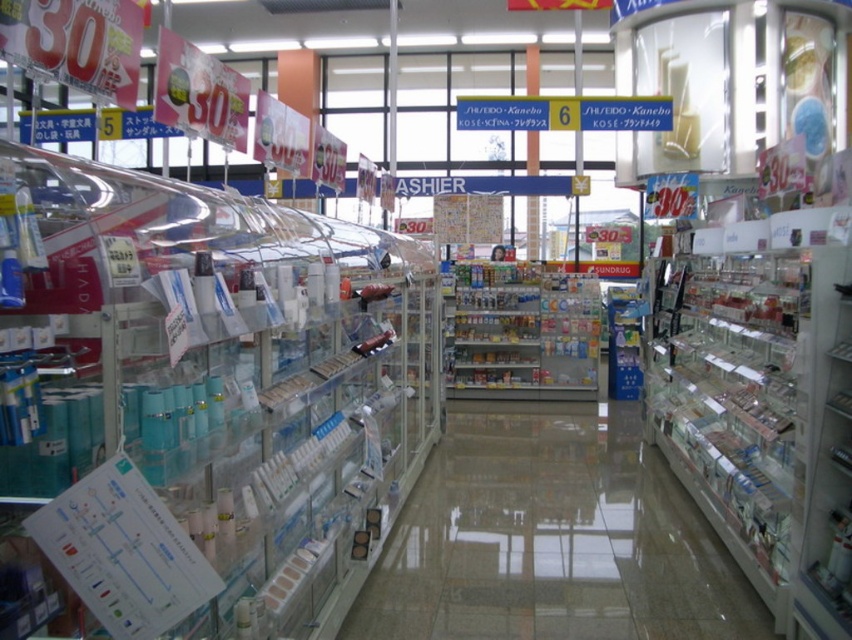
Looking at this image, you are a customer looking for a specific product in the drugstore. You see clear plastic bottles at left and transparent plastic shelves at center. Which object is located to the left of the other?

The clear plastic bottles at left is positioned on the left side of transparent plastic shelves at center.

You are a customer in the store and want to grab a clear plastic bottle from the left. To reach it, you need to bend down. Is the clear plastic bottles at left above or below the transparent plastic shelves at center?

The clear plastic bottles at left is located above the transparent plastic shelves at center, so you can reach it without bending down.